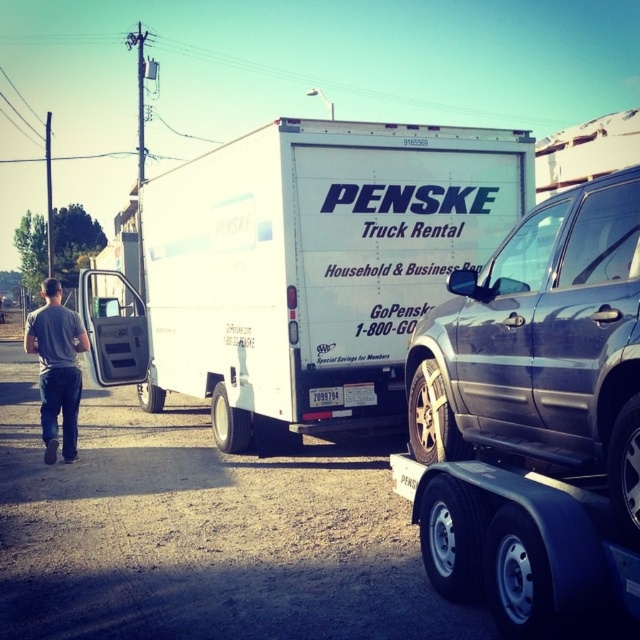
Question: Can you confirm if white matte truck at center is bigger than gray cotton shirt at center?

Choices:
 (A) no
 (B) yes

Answer: (B)

Question: Can you confirm if metallic gray suv at right is positioned to the left of gray cotton shirt at center?

Choices:
 (A) no
 (B) yes

Answer: (A)

Question: Which of these objects is positioned closest to the gray cotton shirt at center?

Choices:
 (A) white matte truck at center
 (B) metallic gray suv at right

Answer: (A)

Question: Does metallic gray suv at right appear under gray cotton shirt at center?

Choices:
 (A) yes
 (B) no

Answer: (B)

Question: Which point is closer to the camera?

Choices:
 (A) metallic gray suv at right
 (B) gray cotton shirt at center
 (C) white matte truck at center

Answer: (A)

Question: Considering the real-world distances, which object is farthest from the gray cotton shirt at center?

Choices:
 (A) metallic gray suv at right
 (B) white matte truck at center

Answer: (A)